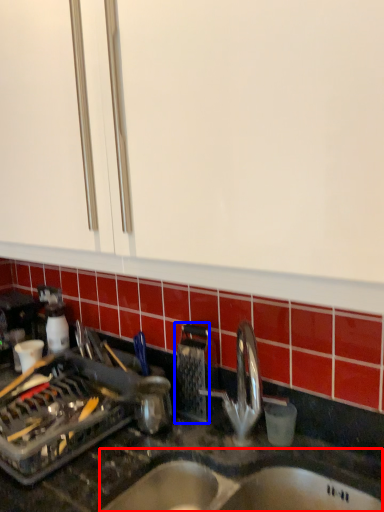
Question: Which object is further to the camera taking this photo, sink (highlighted by a red box) or appliance (highlighted by a blue box)?

Choices:
 (A) sink
 (B) appliance

Answer: (B)